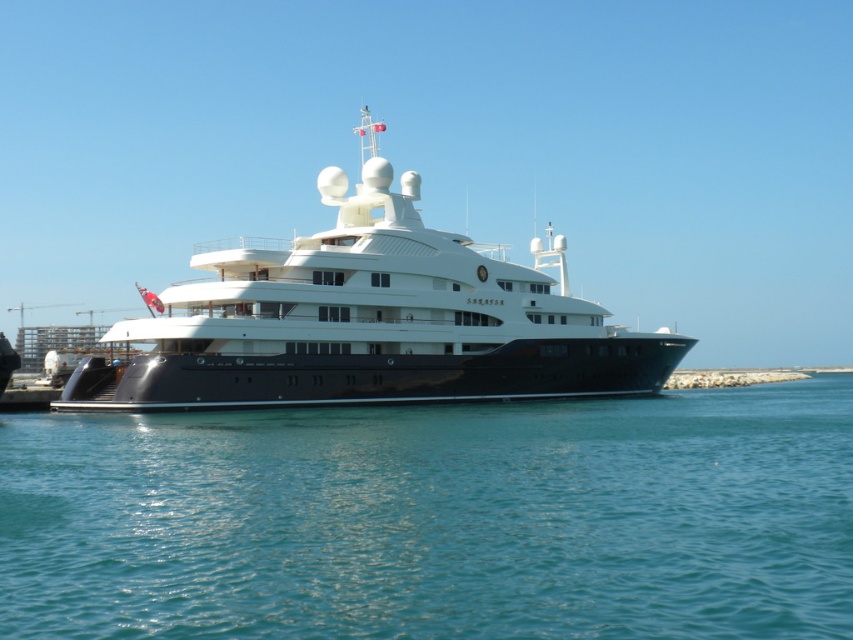
Question: Where is blue water at lower center located in relation to shiny white cruise ship at center in the image?

Choices:
 (A) right
 (B) left

Answer: (A)

Question: Is blue water at lower center to the left of shiny white cruise ship at center from the viewer's perspective?

Choices:
 (A) no
 (B) yes

Answer: (A)

Question: Is blue water at lower center thinner than shiny white cruise ship at center?

Choices:
 (A) no
 (B) yes

Answer: (A)